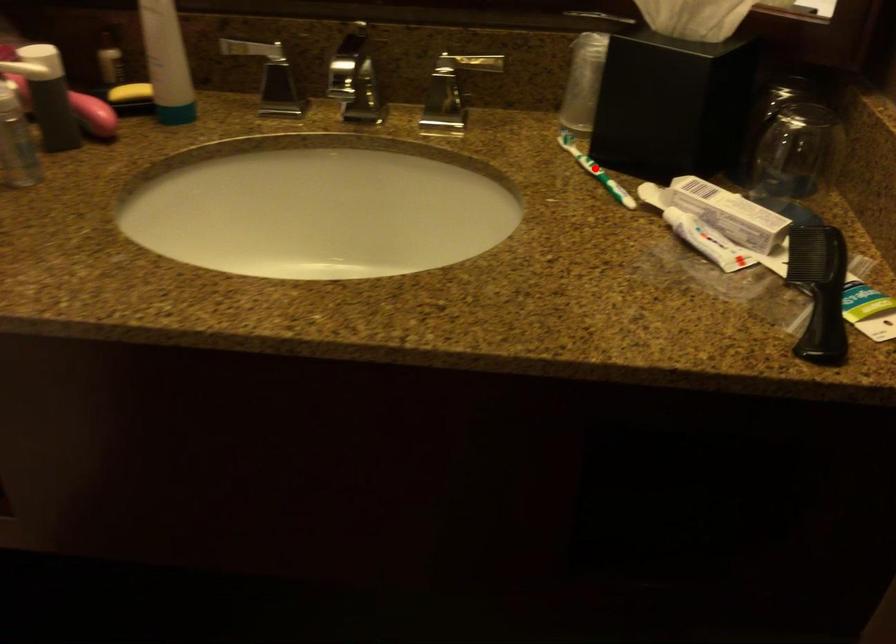
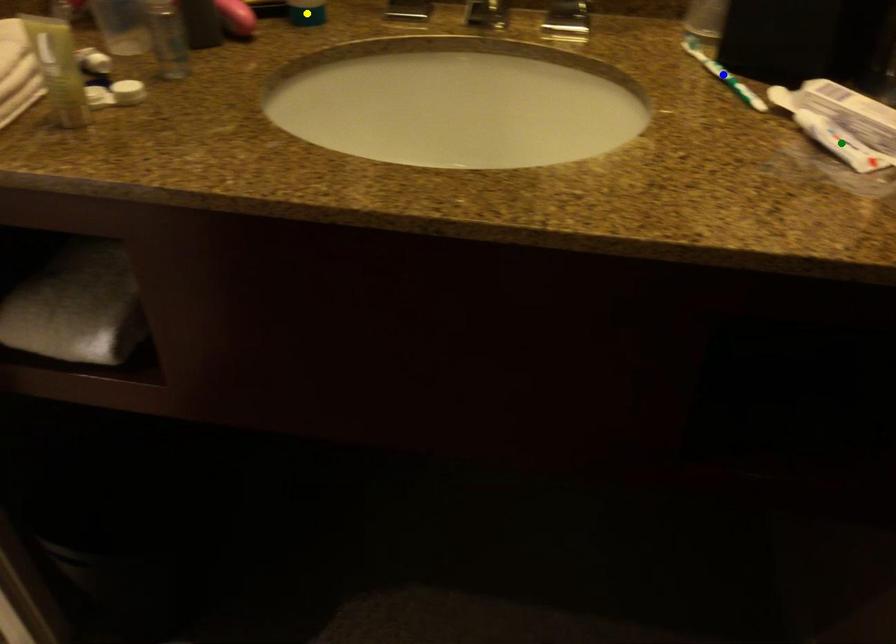
Question: I am providing you with two images of the same scene from different viewpoints. A red point is marked on the first image. You are given multiple points on the second image. Which spot in image 2 lines up with the point in image 1?

Choices:
 (A) blue point
 (B) green point
 (C) yellow point

Answer: (A)